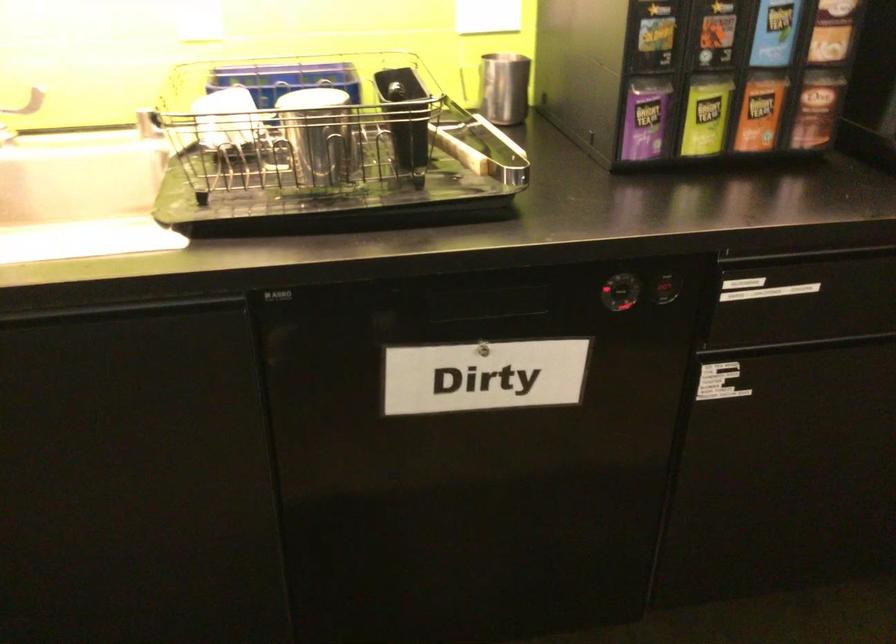
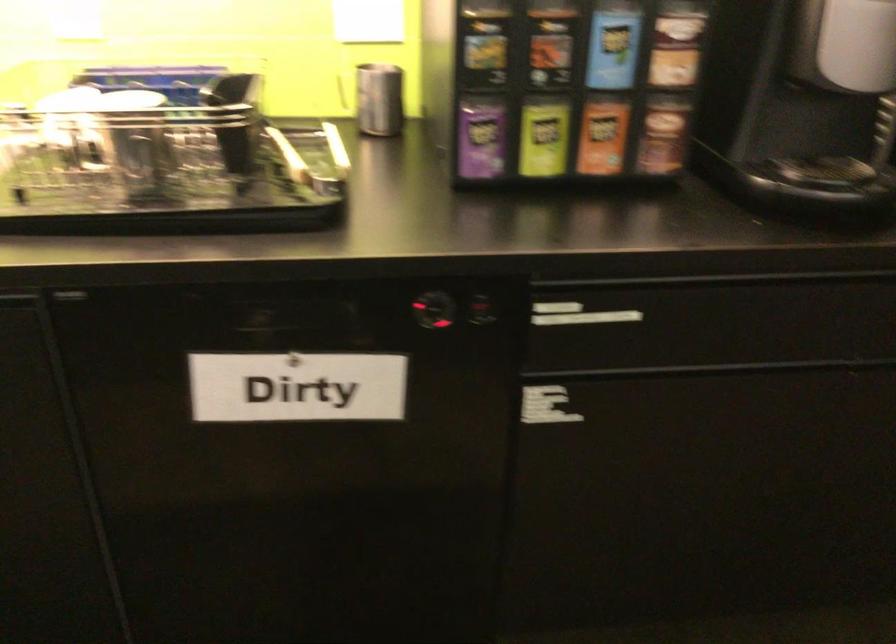
Where in the second image is the point corresponding to the point at 760,111 from the first image?

(602, 136)